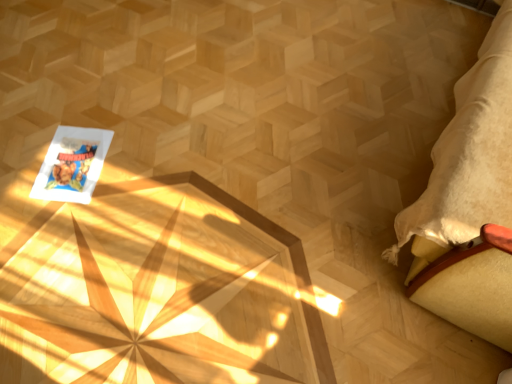
At what (x,y) coordinates should I click in order to perform the action: click on free spot to the left of beige fabric cushion at right. Please return your answer as a coordinate pair (x, y). This screenshot has width=512, height=384. Looking at the image, I should click on (267, 158).